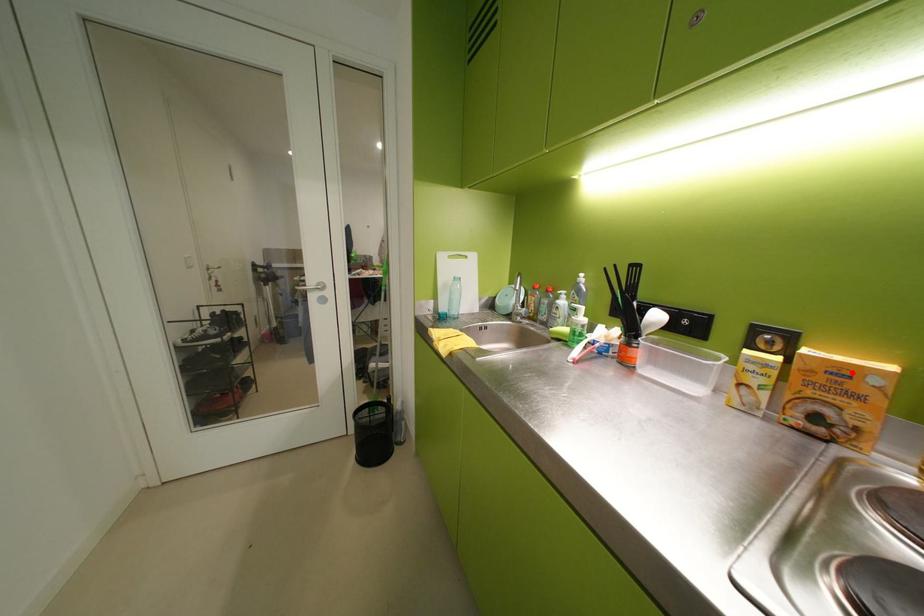
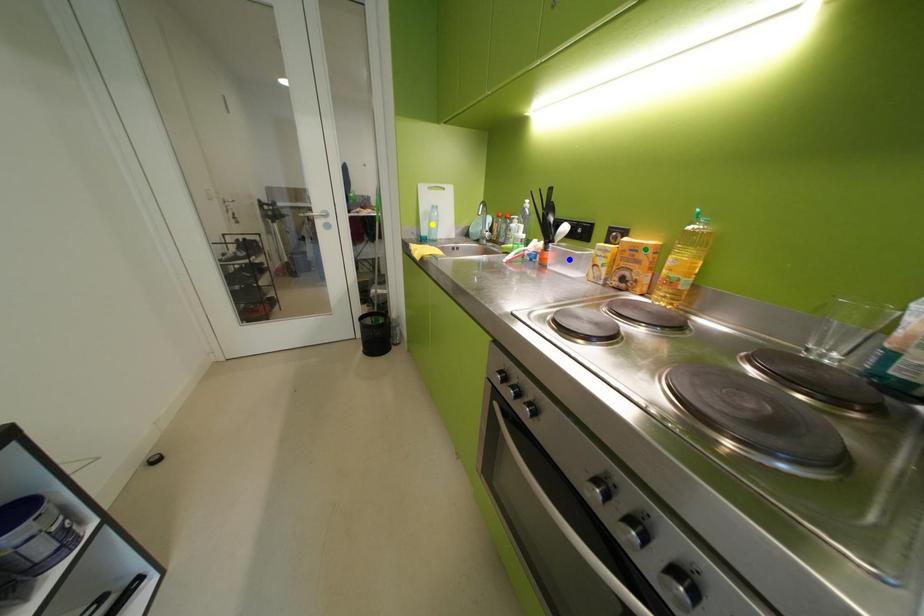
Question: I am providing you with two images of the same scene from different viewpoints. A red point is marked on the first image. You are given multiple points on the second image. Which point in image 2 represents the same 3d spot as the red point in image 1?

Choices:
 (A) blue point
 (B) yellow point
 (C) green point

Answer: (C)